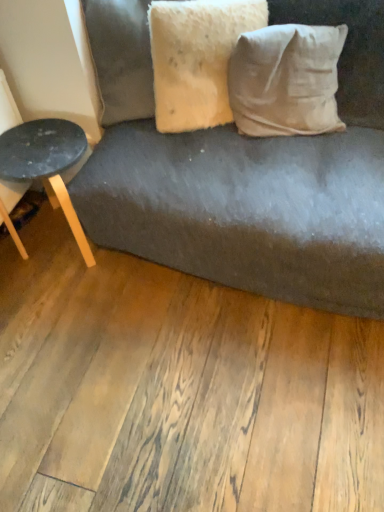
Question: Does point (167, 109) appear closer or farther from the camera than point (297, 74)?

Choices:
 (A) closer
 (B) farther

Answer: (B)

Question: Is fuzzy beige pillow at upper center, placed as the second pillow when sorted from right to left, to the left or to the right of white cotton pillow at upper right, which ranks as the 1th pillow in right-to-left order, in the image?

Choices:
 (A) right
 (B) left

Answer: (B)

Question: Considering the real-world distances, which object is closest to the white cotton pillow at upper right, the 2th pillow when ordered from left to right?

Choices:
 (A) matte black stool at left
 (B) fuzzy beige pillow at upper center, placed as the second pillow when sorted from right to left

Answer: (B)

Question: Based on their relative distances, which object is nearer to the white cotton pillow at upper right, the 2th pillow when ordered from left to right?

Choices:
 (A) fuzzy beige pillow at upper center, the first pillow from the left
 (B) matte black stool at left

Answer: (A)